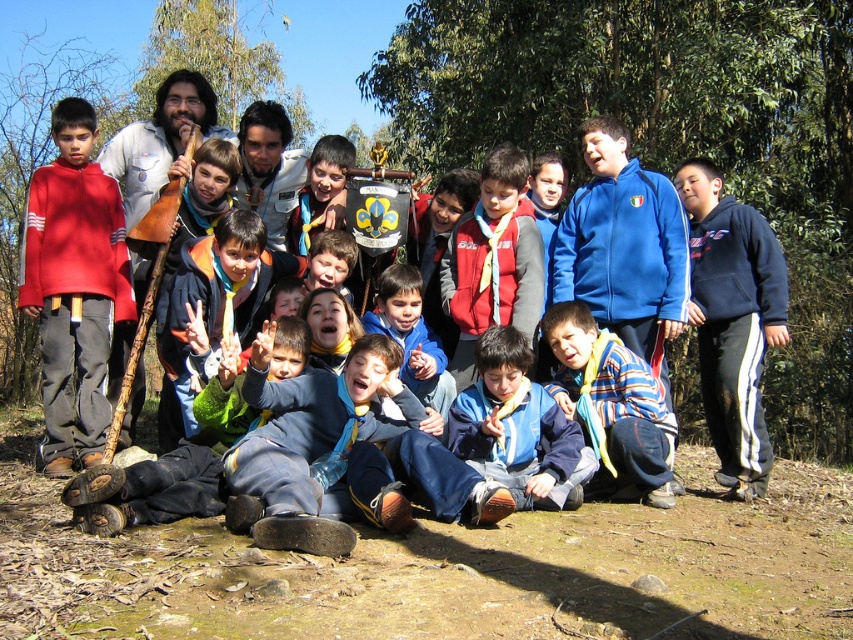
Is blue fabric scarf at center positioned in front of blue fleece jacket at center?

Yes, it is in front of blue fleece jacket at center.

Who is taller, blue fabric scarf at center or blue fleece jacket at center?

With more height is blue fleece jacket at center.

Is point (473, 444) farther from camera compared to point (422, 356)?

No, (473, 444) is closer to viewer.

Identify the location of blue fabric scarf at center. (515, 426).

Is matte red hoodie at left positioned before red fleece vest at center?

No, it is not.

Is matte red hoodie at left taller than red fleece vest at center?

In fact, matte red hoodie at left may be shorter than red fleece vest at center.

Which is in front, point (592, 140) or point (527, 321)?

Positioned in front is point (527, 321).

Locate an element on the screen. This screenshot has width=853, height=640. matte red hoodie at left is located at coordinates (180, 104).

Is matte red sweater at left further to camera compared to blue fabric shirt at center?

Yes.

Who is more forward, [51,429] or [264,332]?

Point [264,332] is in front.

What do you see at coordinates (74, 288) in the screenshot? I see `matte red sweater at left` at bounding box center [74, 288].

Image resolution: width=853 pixels, height=640 pixels. Find the location of `matte red sweater at left`. matte red sweater at left is located at coordinates (74, 288).